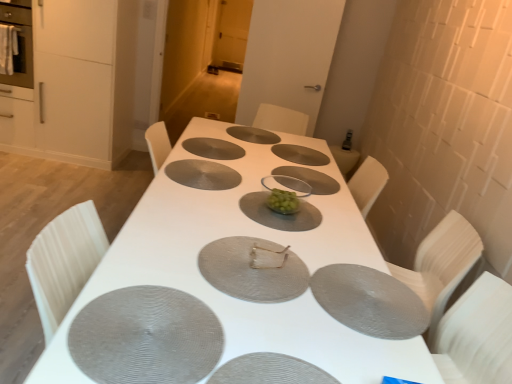
Locate an element on the screen. This screenshot has width=512, height=384. vacant space positioned to the left of metallic silver pizza pan at center, positioned as the 5th pizza pan in back-to-front order is located at coordinates (163, 242).